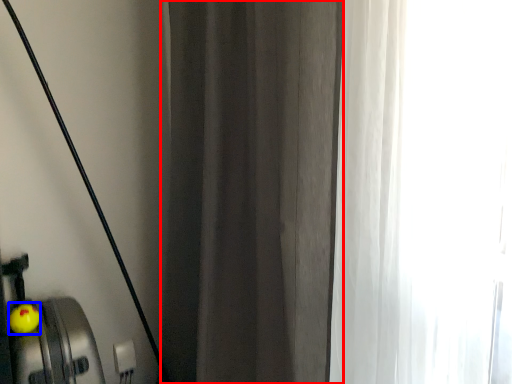
Question: Which object appears closest to the camera in this image, curtain (highlighted by a red box) or apple (highlighted by a blue box)?

Choices:
 (A) curtain
 (B) apple

Answer: (A)